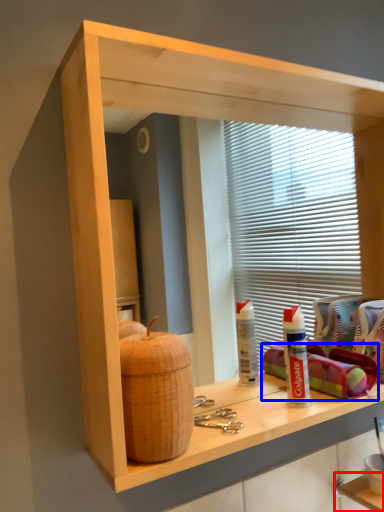
Question: Among these objects, which one is nearest to the camera, shelf (highlighted by a red box) or material (highlighted by a blue box)?

Choices:
 (A) shelf
 (B) material

Answer: (B)